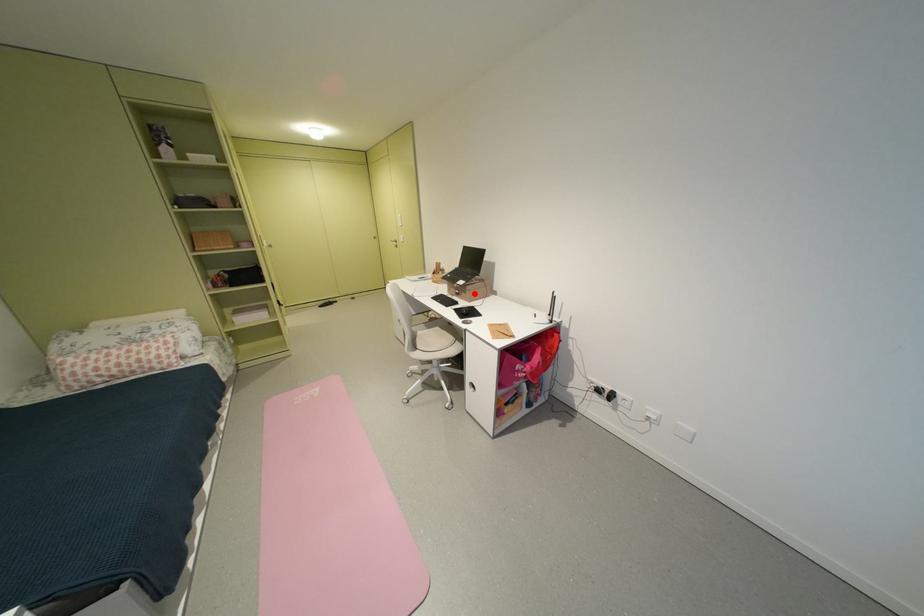
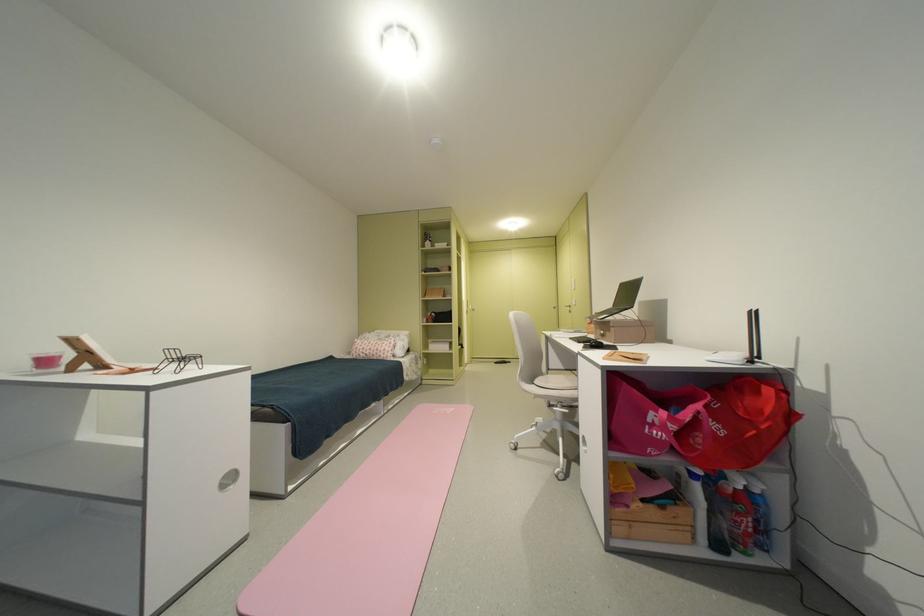
In the second image, find the point that corresponds to the highlighted location in the first image.

(618, 331)